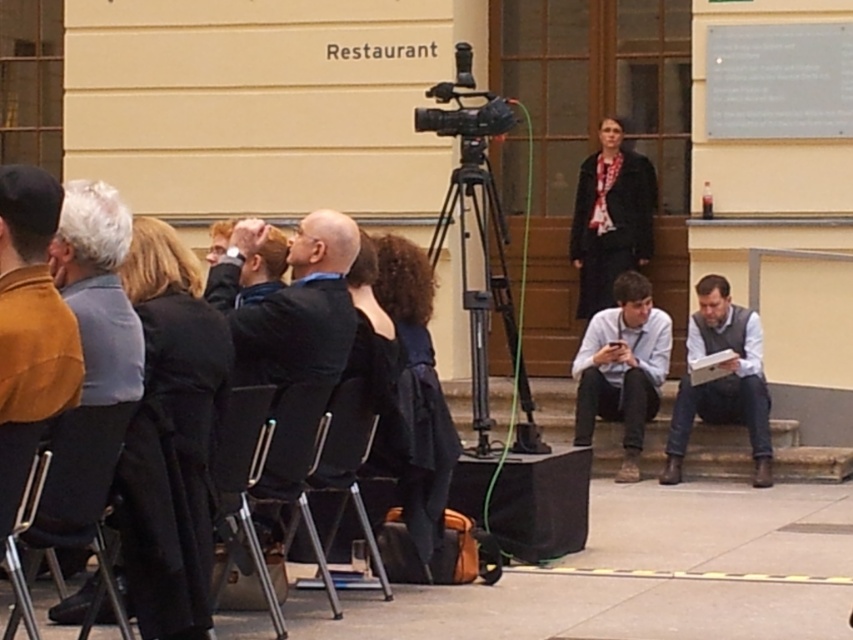
Question: Is matte brown jacket at left smaller than metallic gray chair at lower left?

Choices:
 (A) no
 (B) yes

Answer: (A)

Question: Which of these objects is positioned farthest from the black suit at center?

Choices:
 (A) metallic silver chair at center
 (B) black metal tripod at center
 (C) light blue shirt at lower right

Answer: (C)

Question: Does metallic silver chair at lower center come in front of gray wool sweater at lower right?

Choices:
 (A) yes
 (B) no

Answer: (A)

Question: Among these objects, which one is farthest from the camera?

Choices:
 (A) metallic gray chair at lower left
 (B) gray wool sweater at lower right
 (C) black suit at center
 (D) metallic silver chair at lower left

Answer: (B)

Question: Observing the image, what is the correct spatial positioning of matte brown jacket at left in reference to black suit at center?

Choices:
 (A) right
 (B) left

Answer: (B)

Question: Among these points, which one is farthest from the camera?

Choices:
 (A) (722, 316)
 (B) (505, 320)

Answer: (A)